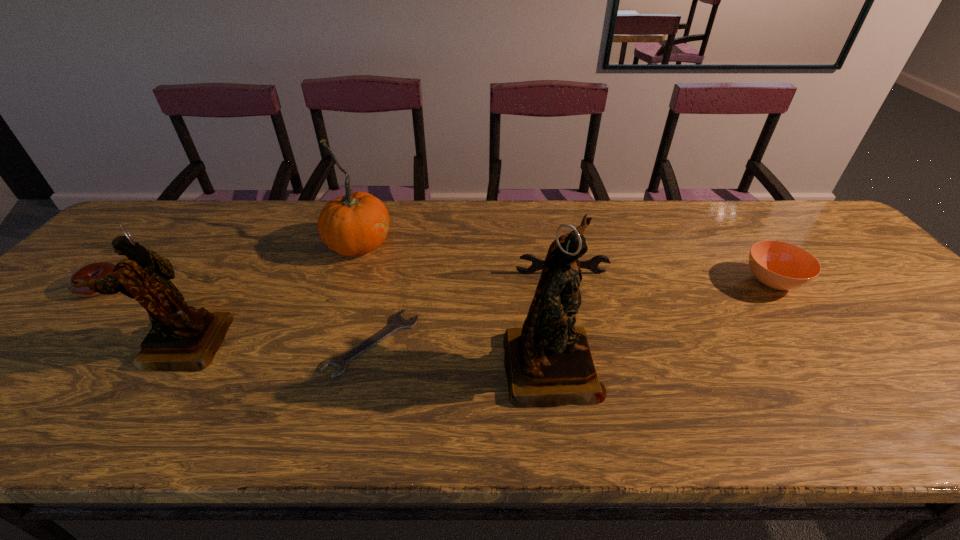
Where is `vacant spot to place a figurine on the right`? The width and height of the screenshot is (960, 540). vacant spot to place a figurine on the right is located at coordinates coord(948,382).